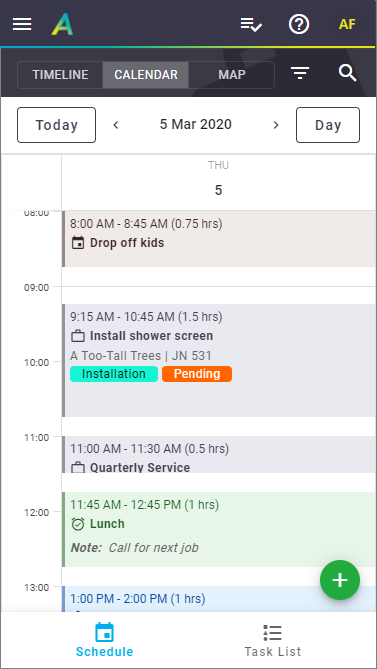
You are a GUI agent. You are given a task and a screenshot of the screen. Output one action in this format:
    pyautogui.click(x=<x>, y=<y>)
    Task: Click on the calendar details
    The image size is (377, 669).
    Given the screenshot: What is the action you would take?
    pyautogui.click(x=205, y=597), pyautogui.click(x=223, y=530), pyautogui.click(x=225, y=462), pyautogui.click(x=281, y=349), pyautogui.click(x=258, y=229)